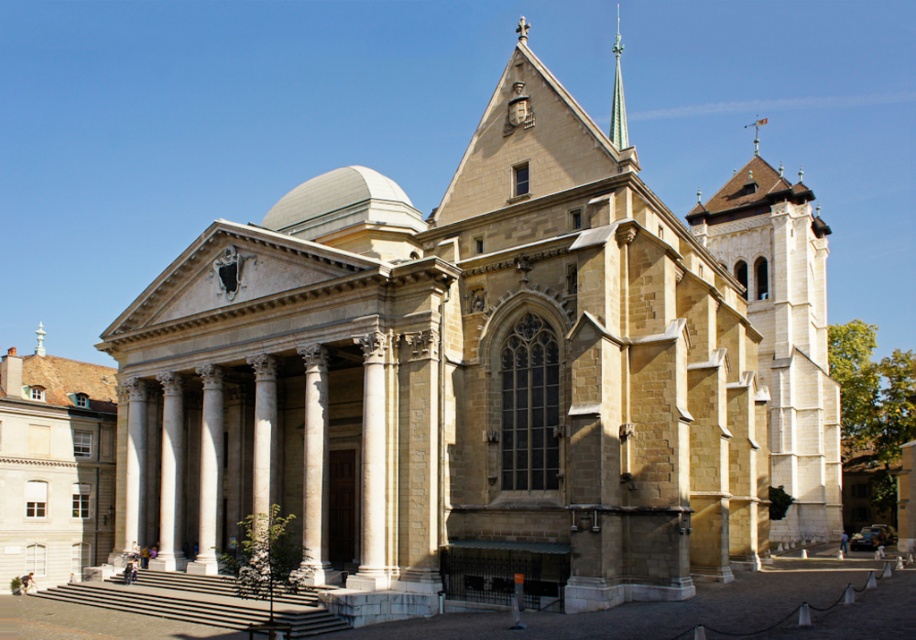
Question: Which point is farther from the camera taking this photo?

Choices:
 (A) (51, 397)
 (B) (616, 8)

Answer: (B)

Question: Does beige stone church at center have a lesser width compared to green glass spire at upper center?

Choices:
 (A) no
 (B) yes

Answer: (A)

Question: Among these points, which one is farthest from the camera?

Choices:
 (A) (82, 564)
 (B) (617, 10)

Answer: (B)

Question: Is beige stone church at center further to camera compared to green glass spire at upper center?

Choices:
 (A) yes
 (B) no

Answer: (A)

Question: Is beige stone church at center wider than green glass spire at upper center?

Choices:
 (A) yes
 (B) no

Answer: (A)